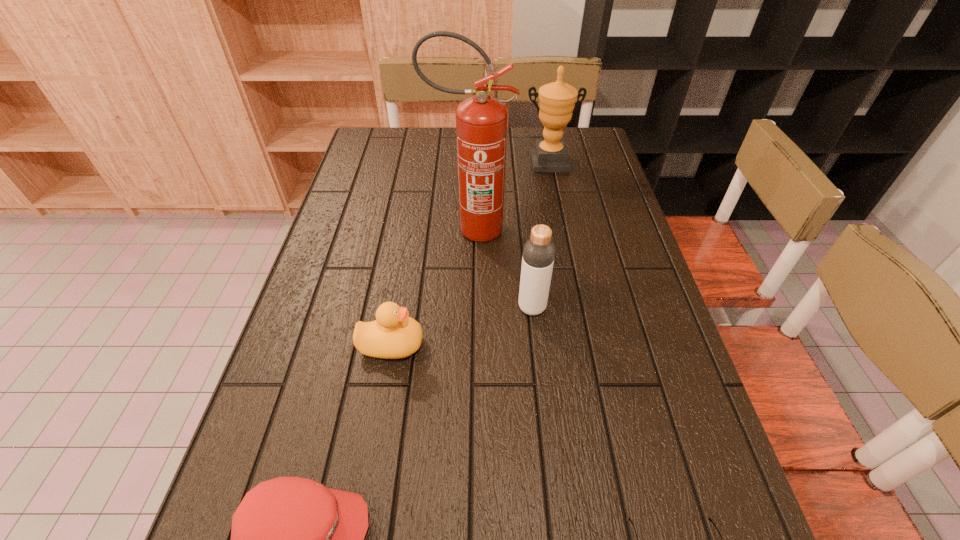
Find the location of a particular element. The image size is (960, 540). vacant area situated 0.050m on the front of the third farthest object is located at coordinates pyautogui.click(x=535, y=336).

You are a GUI agent. You are given a task and a screenshot of the screen. Output one action in this format:
    pyautogui.click(x=<x>, y=<y>)
    Task: Click on the vacant space located 0.310m on the face of the duck
    This screenshot has width=960, height=540.
    Given the screenshot: What is the action you would take?
    pyautogui.click(x=564, y=345)

Locate an element on the screen. This screenshot has width=960, height=540. object that is at the far edge is located at coordinates (557, 100).

The image size is (960, 540). I want to click on object that is at the left edge, so click(x=393, y=335).

Locate an element on the screen. object that is at the right edge is located at coordinates (557, 100).

Locate an element on the screen. object situated at the far right corner is located at coordinates (557, 100).

Identify the location of vacant region at the far edge of the desktop. (407, 159).

You are a GUI agent. You are given a task and a screenshot of the screen. Output one action in this format:
    pyautogui.click(x=<x>, y=<y>)
    Task: Click on the free space at the left edge of the desktop
    This screenshot has width=960, height=540.
    Given the screenshot: What is the action you would take?
    pyautogui.click(x=376, y=254)

The image size is (960, 540). I want to click on vacant area at the right edge, so click(582, 247).

The image size is (960, 540). Identify the location of blank space at the far left corner of the desktop. (399, 129).